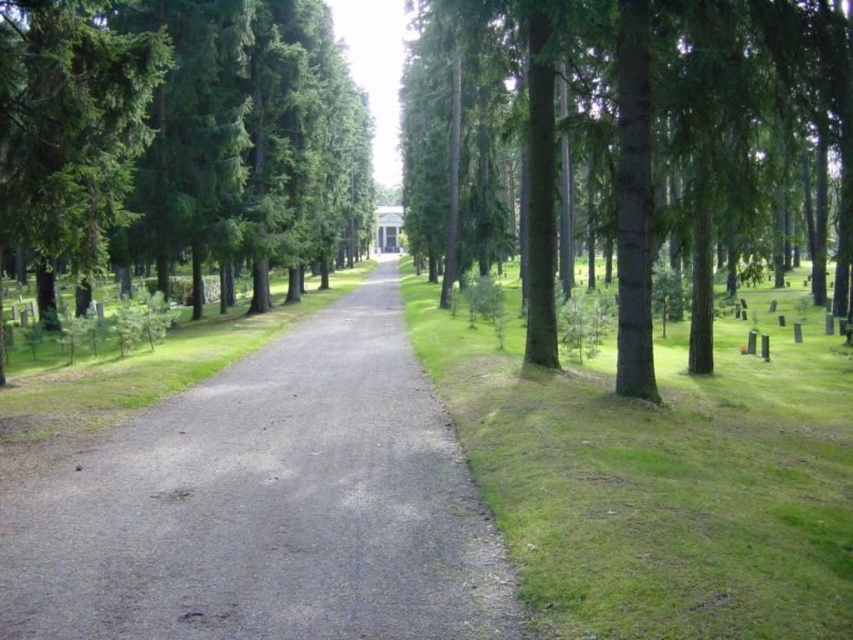
You are standing at the starting point of the gravel pathway in the forest. You notice two points marked in the scene, one at coordinate point [154,480] and another at point [215,17]. Which point is closer to your current position?

Point [154,480] is closer to the camera than point [215,17], so the point at coordinate [154,480] is closer to your current position.

You are standing at the entrance of the forest path and want to find the green smooth tree at upper center. According to the coordinates provided, what are the x and y values of its position?

The green smooth tree at upper center is located at the 2D coordinates of x 0.217 and y 0.746.